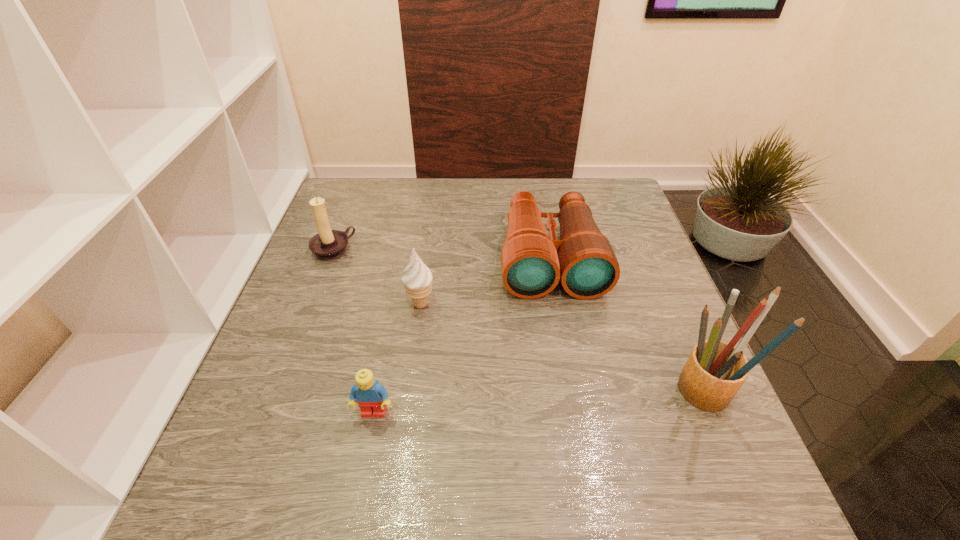
Locate an element on the screen. The image size is (960, 540). pencil box located at the right edge is located at coordinates (714, 372).

Where is `binoculars positioned at the right edge`? binoculars positioned at the right edge is located at coordinates (532, 263).

Identify the location of object at the near right corner. (714, 372).

Locate an element on the screen. The height and width of the screenshot is (540, 960). blank space at the far edge of the desktop is located at coordinates (459, 218).

Where is `vacant region at the near edge of the desktop`? The height and width of the screenshot is (540, 960). vacant region at the near edge of the desktop is located at coordinates (607, 441).

In the image, there is a desktop. Identify the location of vacant region at the left edge. (293, 281).

Locate an element on the screen. The image size is (960, 540). blank space at the right edge of the desktop is located at coordinates (659, 331).

This screenshot has height=540, width=960. In the image, there is a desktop. Identify the location of vacant space at the far left corner. [x=346, y=178].

In the image, there is a desktop. Identify the location of free space at the far right corner. The width and height of the screenshot is (960, 540). [622, 204].

The image size is (960, 540). I want to click on empty location between the leftmost object and the second object from right to left, so click(x=442, y=254).